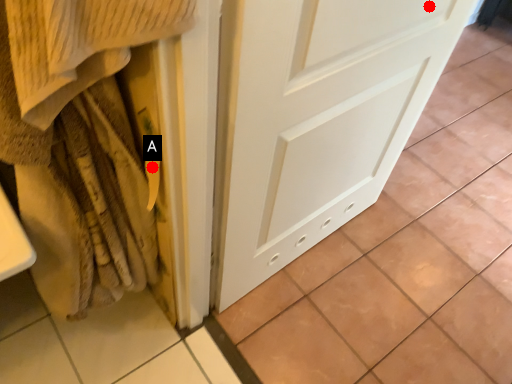
Question: Two points are circled on the image, labeled by A and B beside each circle. Which point is farther from the camera taking this photo?

Choices:
 (A) A is further
 (B) B is further

Answer: (B)